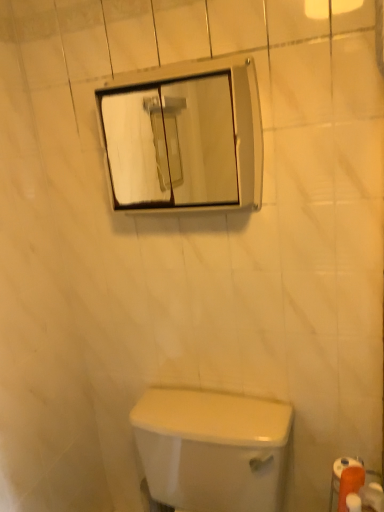
Where is `orange matte toilet paper at lower right, positioned as the 2th toilet paper in left-to-right order`? The width and height of the screenshot is (384, 512). orange matte toilet paper at lower right, positioned as the 2th toilet paper in left-to-right order is located at coordinates (341, 474).

What is the approximate width of white glossy toilet at lower center?

The width of white glossy toilet at lower center is 22.30 inches.

I want to click on white matte toilet paper at lower right, the 1th toilet paper positioned from the left, so click(x=350, y=484).

I want to click on orange matte toilet paper at lower right, placed as the 1th toilet paper when sorted from right to left, so click(x=372, y=498).

The image size is (384, 512). What do you see at coordinates (372, 498) in the screenshot? I see `orange matte toilet paper at lower right, marked as the 3th toilet paper in a left-to-right arrangement` at bounding box center [372, 498].

The width and height of the screenshot is (384, 512). I want to click on clear glass mirror at upper center, so click(x=183, y=137).

Can you confirm if white matte toilet paper at lower right, positioned as the 3th toilet paper in right-to-left order, is thinner than orange matte toilet paper at lower right, positioned as the 2th toilet paper in left-to-right order?

Yes, white matte toilet paper at lower right, positioned as the 3th toilet paper in right-to-left order, is thinner than orange matte toilet paper at lower right, positioned as the 2th toilet paper in left-to-right order.

From the image's perspective, between white matte toilet paper at lower right, the 1th toilet paper positioned from the left, and orange matte toilet paper at lower right, which is counted as the 2th toilet paper, starting from the right, who is located below?

From the image's view, white matte toilet paper at lower right, the 1th toilet paper positioned from the left, is below.

Can you confirm if white matte toilet paper at lower right, positioned as the 3th toilet paper in right-to-left order, is positioned to the right of orange matte toilet paper at lower right, positioned as the 2th toilet paper in left-to-right order?

No, white matte toilet paper at lower right, positioned as the 3th toilet paper in right-to-left order, is not to the right of orange matte toilet paper at lower right, positioned as the 2th toilet paper in left-to-right order.

Does white matte toilet paper at lower right, positioned as the 3th toilet paper in right-to-left order, have a smaller size compared to orange matte toilet paper at lower right, positioned as the 2th toilet paper in left-to-right order?

Indeed, white matte toilet paper at lower right, positioned as the 3th toilet paper in right-to-left order, has a smaller size compared to orange matte toilet paper at lower right, positioned as the 2th toilet paper in left-to-right order.

Which object is closer to the camera taking this photo, orange matte toilet paper at lower right, marked as the 3th toilet paper in a left-to-right arrangement, or clear glass mirror at upper center?

orange matte toilet paper at lower right, marked as the 3th toilet paper in a left-to-right arrangement.

Is orange matte toilet paper at lower right, placed as the 1th toilet paper when sorted from right to left, turned away from clear glass mirror at upper center?

No, clear glass mirror at upper center is not at the back of orange matte toilet paper at lower right, placed as the 1th toilet paper when sorted from right to left.

What's the angular difference between orange matte toilet paper at lower right, marked as the 3th toilet paper in a left-to-right arrangement, and clear glass mirror at upper center's facing directions?

They differ by 94.8 degrees in their facing directions.

Is orange matte toilet paper at lower right, marked as the 3th toilet paper in a left-to-right arrangement, far away from clear glass mirror at upper center?

Indeed, orange matte toilet paper at lower right, marked as the 3th toilet paper in a left-to-right arrangement, is not near clear glass mirror at upper center.

Considering the positions of point (355, 489) and point (381, 498), is point (355, 489) closer or farther from the camera than point (381, 498)?

Point (355, 489).

Is white matte toilet paper at lower right, positioned as the 3th toilet paper in right-to-left order, at the left side of orange matte toilet paper at lower right, placed as the 1th toilet paper when sorted from right to left?

Correct, you'll find white matte toilet paper at lower right, positioned as the 3th toilet paper in right-to-left order, to the left of orange matte toilet paper at lower right, placed as the 1th toilet paper when sorted from right to left.

Considering the relative sizes of white matte toilet paper at lower right, positioned as the 3th toilet paper in right-to-left order, and orange matte toilet paper at lower right, marked as the 3th toilet paper in a left-to-right arrangement, in the image provided, is white matte toilet paper at lower right, positioned as the 3th toilet paper in right-to-left order, wider than orange matte toilet paper at lower right, marked as the 3th toilet paper in a left-to-right arrangement,?

Incorrect, the width of white matte toilet paper at lower right, positioned as the 3th toilet paper in right-to-left order, does not surpass that of orange matte toilet paper at lower right, marked as the 3th toilet paper in a left-to-right arrangement.

From a real-world perspective, who is located lower, white matte toilet paper at lower right, positioned as the 3th toilet paper in right-to-left order, or orange matte toilet paper at lower right, marked as the 3th toilet paper in a left-to-right arrangement?

orange matte toilet paper at lower right, marked as the 3th toilet paper in a left-to-right arrangement, is physically lower.

Is point (377, 507) farther from viewer compared to point (360, 474)?

No, (377, 507) is closer to viewer.

How many degrees apart are the facing directions of orange matte toilet paper at lower right, marked as the 3th toilet paper in a left-to-right arrangement, and orange matte toilet paper at lower right, which is counted as the 2th toilet paper, starting from the right?

The angular difference between orange matte toilet paper at lower right, marked as the 3th toilet paper in a left-to-right arrangement, and orange matte toilet paper at lower right, which is counted as the 2th toilet paper, starting from the right, is 40.6 degrees.

From a real-world perspective, is orange matte toilet paper at lower right, marked as the 3th toilet paper in a left-to-right arrangement, beneath orange matte toilet paper at lower right, which is counted as the 2th toilet paper, starting from the right?

Yes, from a real-world perspective, orange matte toilet paper at lower right, marked as the 3th toilet paper in a left-to-right arrangement, is below orange matte toilet paper at lower right, which is counted as the 2th toilet paper, starting from the right.

Considering the relative positions of white glossy toilet at lower center and white matte toilet paper at lower right, positioned as the 3th toilet paper in right-to-left order, in the image provided, is white glossy toilet at lower center behind white matte toilet paper at lower right, positioned as the 3th toilet paper in right-to-left order,?

No, white glossy toilet at lower center is in front of white matte toilet paper at lower right, positioned as the 3th toilet paper in right-to-left order.

Consider the image. Could you measure the distance between white glossy toilet at lower center and white matte toilet paper at lower right, the 1th toilet paper positioned from the left?

A distance of 40.62 centimeters exists between white glossy toilet at lower center and white matte toilet paper at lower right, the 1th toilet paper positioned from the left.

Identify the location of the 1st toilet paper behind the white glossy toilet at lower center. The height and width of the screenshot is (512, 384). (350, 484).

Does white glossy toilet at lower center have a greater height compared to white matte toilet paper at lower right, the 1th toilet paper positioned from the left?

Yes, white glossy toilet at lower center is taller than white matte toilet paper at lower right, the 1th toilet paper positioned from the left.

Is orange matte toilet paper at lower right, placed as the 1th toilet paper when sorted from right to left, smaller than white matte toilet paper at lower right, the 1th toilet paper positioned from the left?

Incorrect, orange matte toilet paper at lower right, placed as the 1th toilet paper when sorted from right to left, is not smaller in size than white matte toilet paper at lower right, the 1th toilet paper positioned from the left.

Does orange matte toilet paper at lower right, marked as the 3th toilet paper in a left-to-right arrangement, have a greater width compared to white matte toilet paper at lower right, the 1th toilet paper positioned from the left?

Indeed, orange matte toilet paper at lower right, marked as the 3th toilet paper in a left-to-right arrangement, has a greater width compared to white matte toilet paper at lower right, the 1th toilet paper positioned from the left.

In the scene shown: Does orange matte toilet paper at lower right, marked as the 3th toilet paper in a left-to-right arrangement, lie in front of white matte toilet paper at lower right, the 1th toilet paper positioned from the left?

No, the depth of orange matte toilet paper at lower right, marked as the 3th toilet paper in a left-to-right arrangement, is greater than that of white matte toilet paper at lower right, the 1th toilet paper positioned from the left.

Are orange matte toilet paper at lower right, placed as the 1th toilet paper when sorted from right to left, and white matte toilet paper at lower right, the 1th toilet paper positioned from the left, far apart?

orange matte toilet paper at lower right, placed as the 1th toilet paper when sorted from right to left, is near white matte toilet paper at lower right, the 1th toilet paper positioned from the left, not far away.

Which is in front, white matte toilet paper at lower right, positioned as the 3th toilet paper in right-to-left order, or clear glass mirror at upper center?

Positioned in front is white matte toilet paper at lower right, positioned as the 3th toilet paper in right-to-left order.

From a real-world perspective, which object rests below the other?

white matte toilet paper at lower right, positioned as the 3th toilet paper in right-to-left order, from a real-world perspective.

Is point (344, 483) closer to viewer compared to point (106, 161)?

Yes, it is.

Between white matte toilet paper at lower right, positioned as the 3th toilet paper in right-to-left order, and clear glass mirror at upper center, which one has smaller width?

With smaller width is white matte toilet paper at lower right, positioned as the 3th toilet paper in right-to-left order.

Where is `the 2nd toilet paper behind the white matte toilet paper at lower right, the 1th toilet paper positioned from the left, counting from the anchor's position`? the 2nd toilet paper behind the white matte toilet paper at lower right, the 1th toilet paper positioned from the left, counting from the anchor's position is located at coordinates (341, 474).

I want to click on the 3rd toilet paper counting from the right of the clear glass mirror at upper center, so click(372, 498).

Considering their positions, is orange matte toilet paper at lower right, which is counted as the 2th toilet paper, starting from the right, positioned further to white matte toilet paper at lower right, the 1th toilet paper positioned from the left, than orange matte toilet paper at lower right, marked as the 3th toilet paper in a left-to-right arrangement?

orange matte toilet paper at lower right, which is counted as the 2th toilet paper, starting from the right.

Consider the image. Which object lies nearer to the anchor point white matte toilet paper at lower right, positioned as the 3th toilet paper in right-to-left order, white glossy toilet at lower center or orange matte toilet paper at lower right, which is counted as the 2th toilet paper, starting from the right?

orange matte toilet paper at lower right, which is counted as the 2th toilet paper, starting from the right, is positioned closer to the anchor white matte toilet paper at lower right, positioned as the 3th toilet paper in right-to-left order.

Which object lies nearer to the anchor point white glossy toilet at lower center, orange matte toilet paper at lower right, positioned as the 2th toilet paper in left-to-right order, or clear glass mirror at upper center?

orange matte toilet paper at lower right, positioned as the 2th toilet paper in left-to-right order, lies closer to white glossy toilet at lower center than the other object.

Based on their spatial positions, is orange matte toilet paper at lower right, placed as the 1th toilet paper when sorted from right to left, or white glossy toilet at lower center further from clear glass mirror at upper center?

Based on the image, orange matte toilet paper at lower right, placed as the 1th toilet paper when sorted from right to left, appears to be further to clear glass mirror at upper center.

From the image, which object appears to be nearer to clear glass mirror at upper center, orange matte toilet paper at lower right, positioned as the 2th toilet paper in left-to-right order, or orange matte toilet paper at lower right, marked as the 3th toilet paper in a left-to-right arrangement?

orange matte toilet paper at lower right, positioned as the 2th toilet paper in left-to-right order, is closer to clear glass mirror at upper center.

When comparing their distances from white matte toilet paper at lower right, positioned as the 3th toilet paper in right-to-left order, does clear glass mirror at upper center or white glossy toilet at lower center seem further?

The object further to white matte toilet paper at lower right, positioned as the 3th toilet paper in right-to-left order, is clear glass mirror at upper center.

Based on their spatial positions, is clear glass mirror at upper center or white glossy toilet at lower center further from orange matte toilet paper at lower right, positioned as the 2th toilet paper in left-to-right order?

Based on the image, clear glass mirror at upper center appears to be further to orange matte toilet paper at lower right, positioned as the 2th toilet paper in left-to-right order.

Considering their positions, is white glossy toilet at lower center positioned further to clear glass mirror at upper center than white matte toilet paper at lower right, positioned as the 3th toilet paper in right-to-left order?

white matte toilet paper at lower right, positioned as the 3th toilet paper in right-to-left order.

Where is `toilet paper between clear glass mirror at upper center and orange matte toilet paper at lower right, marked as the 3th toilet paper in a left-to-right arrangement, in the vertical direction`? toilet paper between clear glass mirror at upper center and orange matte toilet paper at lower right, marked as the 3th toilet paper in a left-to-right arrangement, in the vertical direction is located at coordinates (341, 474).

Locate an element on the screen. toilet paper between white glossy toilet at lower center and orange matte toilet paper at lower right, which is counted as the 2th toilet paper, starting from the right is located at coordinates (350, 484).

The height and width of the screenshot is (512, 384). Identify the location of toilet paper located between white matte toilet paper at lower right, the 1th toilet paper positioned from the left, and orange matte toilet paper at lower right, marked as the 3th toilet paper in a left-to-right arrangement, in the left-right direction. (341, 474).